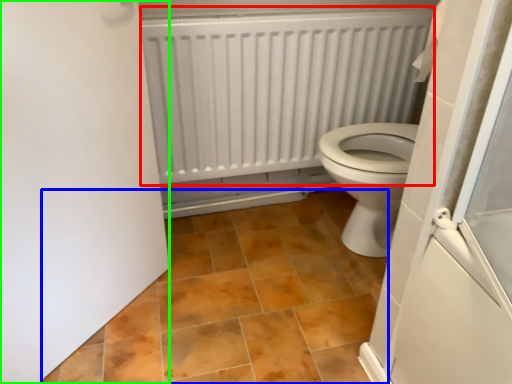
Question: Based on their relative distances, which object is nearer to radiator (highlighted by a red box)? Choose from ceramic tile (highlighted by a blue box) and door (highlighted by a green box).

Choices:
 (A) ceramic tile
 (B) door

Answer: (A)